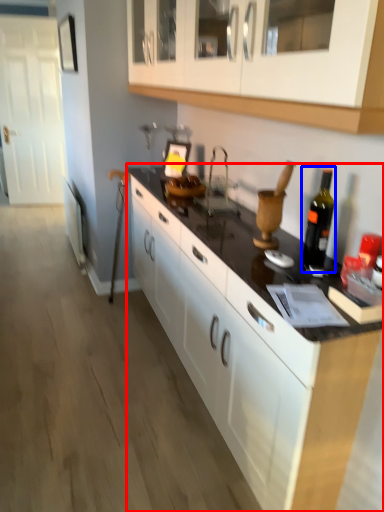
Question: Which object is further to the camera taking this photo, countertop (highlighted by a red box) or bottle (highlighted by a blue box)?

Choices:
 (A) countertop
 (B) bottle

Answer: (B)